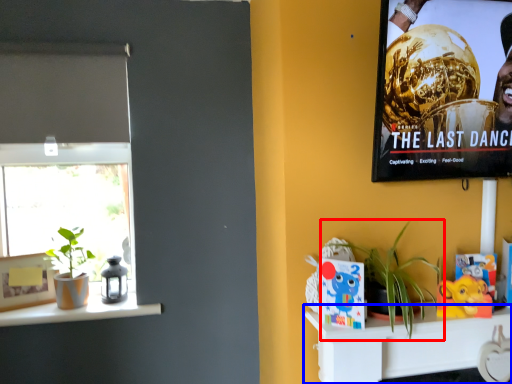
Question: Which of the following is the closest to the observer, houseplant (highlighted by a red box) or shelf (highlighted by a blue box)?

Choices:
 (A) houseplant
 (B) shelf

Answer: (A)